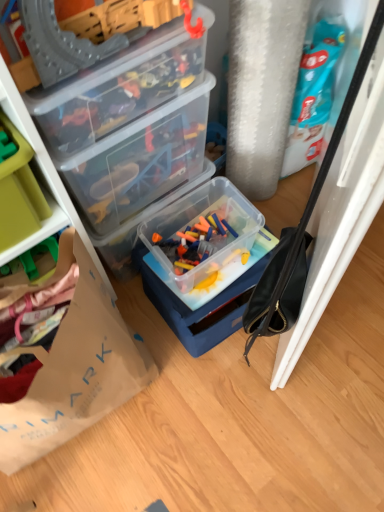
Question: Can you confirm if transparent plastic container at upper left, positioned as the 2th box in bottom-to-top order, is smaller than green plastic storage box at left?

Choices:
 (A) yes
 (B) no

Answer: (B)

Question: Is transparent plastic container at upper left, the second box positioned from the top, positioned before green plastic storage box at left?

Choices:
 (A) yes
 (B) no

Answer: (B)

Question: Considering the relative sizes of transparent plastic container at upper left, positioned as the 2th box in bottom-to-top order, and green plastic storage box at left in the image provided, is transparent plastic container at upper left, positioned as the 2th box in bottom-to-top order, taller than green plastic storage box at left?

Choices:
 (A) no
 (B) yes

Answer: (B)

Question: Is green plastic storage box at left a part of transparent plastic container at upper left, positioned as the 2th box in bottom-to-top order?

Choices:
 (A) no
 (B) yes

Answer: (A)

Question: Looking at their shapes, would you say brown paper bag at lower left is wider or thinner than transparent plastic container at upper left, positioned as the 2th box in bottom-to-top order?

Choices:
 (A) thin
 (B) wide

Answer: (B)

Question: In the image, is brown paper bag at lower left on the left side or the right side of transparent plastic container at upper left, positioned as the 2th box in bottom-to-top order?

Choices:
 (A) right
 (B) left

Answer: (B)

Question: From the image's perspective, relative to transparent plastic container at upper left, positioned as the 2th box in bottom-to-top order, is brown paper bag at lower left above or below?

Choices:
 (A) above
 (B) below

Answer: (B)

Question: Is brown paper bag at lower left in front of or behind transparent plastic container at upper left, the second box positioned from the top, in the image?

Choices:
 (A) behind
 (B) front

Answer: (B)

Question: Considering the positions of transparent plastic toy box at upper center, the third box in the bottom-to-top sequence, and transparent plastic container at upper left, the second box positioned from the top, in the image, is transparent plastic toy box at upper center, the third box in the bottom-to-top sequence, bigger or smaller than transparent plastic container at upper left, the second box positioned from the top,?

Choices:
 (A) big
 (B) small

Answer: (B)

Question: From a real-world perspective, is transparent plastic toy box at upper center, the 1th box when ordered from top to bottom, physically located above or below transparent plastic container at upper left, the second box positioned from the top?

Choices:
 (A) above
 (B) below

Answer: (A)

Question: Is point (112, 83) closer or farther from the camera than point (92, 200)?

Choices:
 (A) closer
 (B) farther

Answer: (A)

Question: Relative to transparent plastic container at upper left, the second box positioned from the top, is transparent plastic toy box at upper center, the 1th box when ordered from top to bottom, in front or behind?

Choices:
 (A) front
 (B) behind

Answer: (A)

Question: Which is correct: translucent plastic container at center, the 3th box in the top-to-bottom sequence, is inside brown paper bag at lower left, or outside of it?

Choices:
 (A) outside
 (B) inside

Answer: (A)

Question: Based on their sizes in the image, would you say translucent plastic container at center, the 3th box in the top-to-bottom sequence, is bigger or smaller than brown paper bag at lower left?

Choices:
 (A) small
 (B) big

Answer: (A)